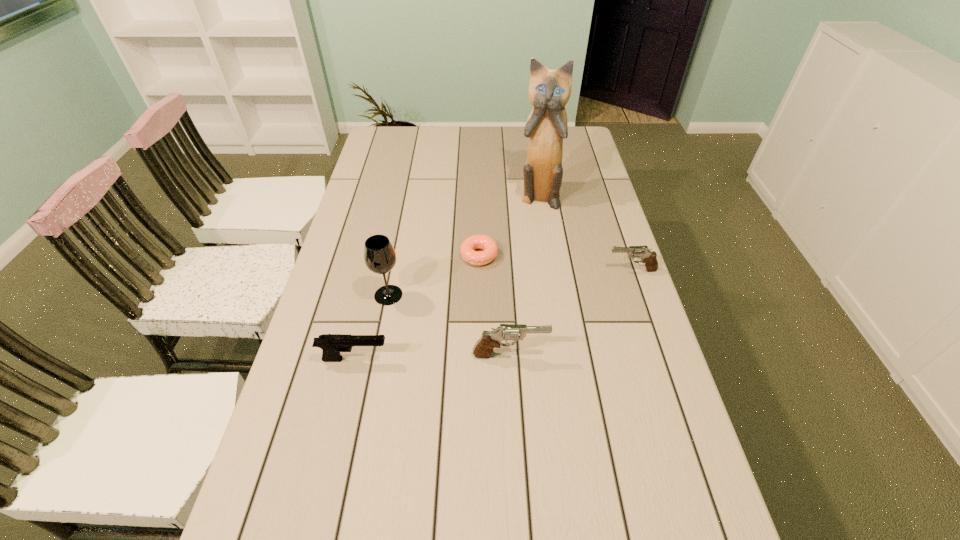
At what (x,y) coordinates should I click in order to perform the action: click on vacant region between the leftmost pistol and the doughnut. Please return your answer as a coordinate pair (x, y). The width and height of the screenshot is (960, 540). Looking at the image, I should click on (417, 307).

This screenshot has height=540, width=960. Find the location of `free space between the tallest pistol and the fifth shortest object`. free space between the tallest pistol and the fifth shortest object is located at coordinates (449, 325).

Where is `free space between the cat and the leftmost pistol`? The image size is (960, 540). free space between the cat and the leftmost pistol is located at coordinates [446, 278].

Where is `vacant space in between the shortest object and the cat`? vacant space in between the shortest object and the cat is located at coordinates [x=509, y=226].

Find the location of a particular element. The image size is (960, 540). object identified as the closest to the leftmost pistol is located at coordinates (379, 255).

Find the location of a particular element. The height and width of the screenshot is (540, 960). object that is the fourth closest to the rightmost object is located at coordinates (379, 255).

Select which pistol is the second closest to the tallest pistol. Please provide its 2D coordinates. Your answer should be formatted as a tuple, i.e. [(x, y)], where the tuple contains the x and y coordinates of a point satisfying the conditions above.

[(648, 257)]

Identify the location of pistol that can be found as the closest to the farthest pistol. (489, 340).

What are the coordinates of `free location that satisfies the following two spatial constraints: 1. on the face of the farthest object; 2. at the barrel of the second pistol from right to left` in the screenshot? It's located at (563, 355).

At what (x,y) coordinates should I click in order to perform the action: click on free space that satisfies the following two spatial constraints: 1. on the front side of the doughnut; 2. on the front-facing side of the leftmost pistol. Please return your answer as a coordinate pair (x, y). The width and height of the screenshot is (960, 540). Looking at the image, I should click on (479, 359).